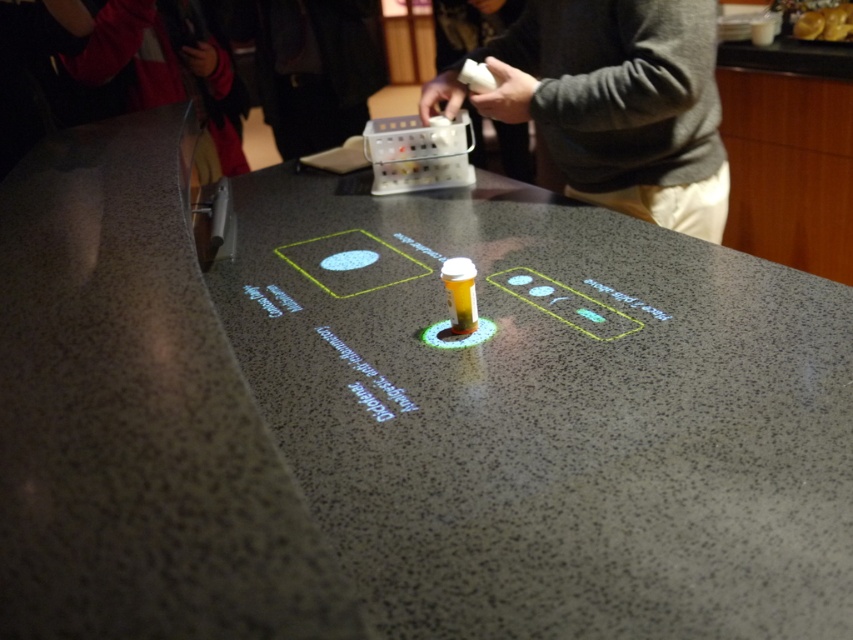
Who is higher up, speckled granite counter at center or red jacket at upper left?

Positioned higher is red jacket at upper left.

Which is below, speckled granite counter at center or red jacket at upper left?

speckled granite counter at center is below.

I want to click on speckled granite counter at center, so click(x=547, y=412).

You are a GUI agent. You are given a task and a screenshot of the screen. Output one action in this format:
    pyautogui.click(x=<x>, y=<y>)
    Task: Click on the speckled granite counter at center
    
    Given the screenshot: What is the action you would take?
    pyautogui.click(x=547, y=412)

Which is more to the left, gray sweater at upper center or red jacket at upper left?

From the viewer's perspective, red jacket at upper left appears more on the left side.

Who is higher up, gray sweater at upper center or red jacket at upper left?

Positioned higher is red jacket at upper left.

Who is more distant from viewer, (x=701, y=3) or (x=154, y=44)?

The point (x=154, y=44) is more distant.

Locate an element on the screen. Image resolution: width=853 pixels, height=640 pixels. gray sweater at upper center is located at coordinates (619, 104).

Is point (804, 340) positioned before point (648, 180)?

Yes, it is in front of point (648, 180).

Looking at this image, does speckled granite counter at center have a smaller size compared to gray sweater at upper center?

No, speckled granite counter at center is not smaller than gray sweater at upper center.

I want to click on speckled granite counter at center, so click(547, 412).

You are a GUI agent. You are given a task and a screenshot of the screen. Output one action in this format:
    pyautogui.click(x=<x>, y=<y>)
    Task: Click on the speckled granite counter at center
    The image size is (853, 640).
    Given the screenshot: What is the action you would take?
    pyautogui.click(x=547, y=412)